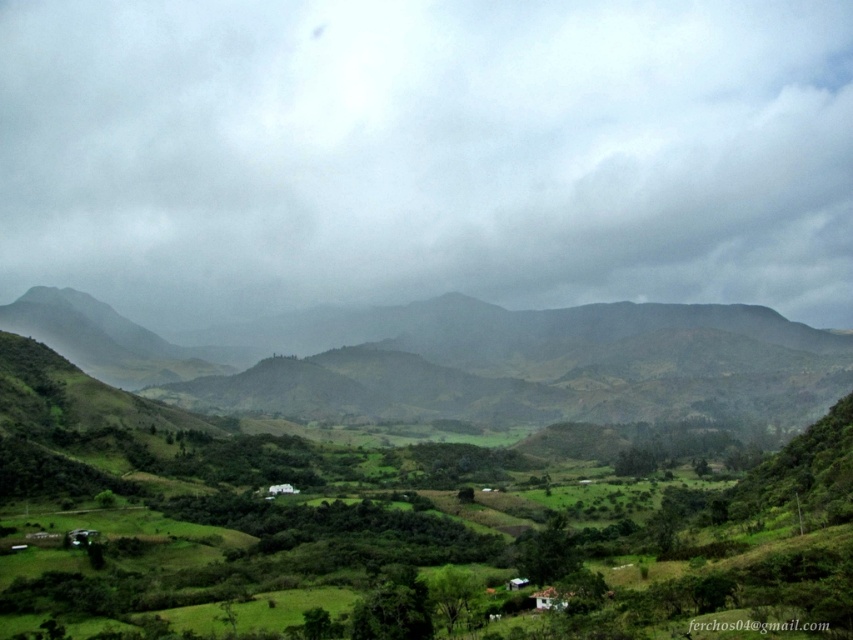
You are a hiker standing on the green grassy hill at center and looking towards the cloudy sky at upper center. Which object appears higher in your field of view?

The cloudy sky at upper center appears higher in your field of view because it is taller than the green grassy hill at center.

You are an airplane pilot flying over the landscape and need to report the size comparison between the cloudy sky at upper center and the green grassy hill at center. Which one appears bigger?

The cloudy sky at upper center is larger in size than the green grassy hill at center.